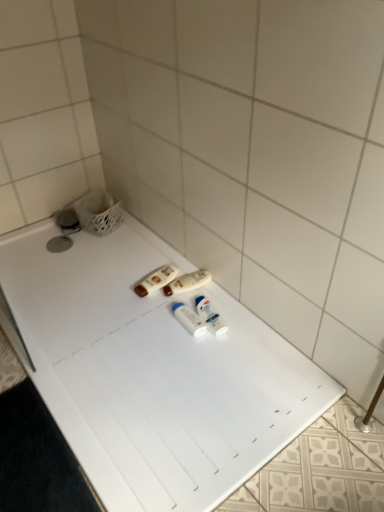
You are a GUI agent. You are given a task and a screenshot of the screen. Output one action in this format:
    pyautogui.click(x=<x>, y=<y>)
    Task: Click on the unoccupied area in front of white plastic bottles at center, the 3th toiletry when ordered from left to right
    
    Given the screenshot: What is the action you would take?
    pyautogui.click(x=186, y=358)